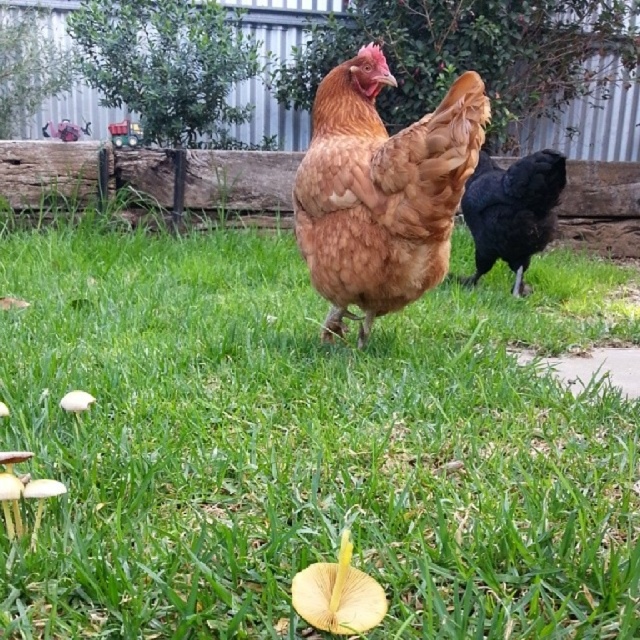
You are a gardener looking at the backyard scene. You need to place a new plant between the green grass at center and the shiny black chicken at right. Based on their positions, which object should the plant be closer to?

The green grass at center is positioned on the left side of shiny black chicken at right, so the plant should be placed closer to the shiny black chicken at right to maintain the spatial arrangement.

You are standing in the backyard looking at the two chickens. There is a point marked at coordinates [381,189]. Which chicken is this point located on?

The point at coordinates [381,189] is located on the brown feathered chicken at center.